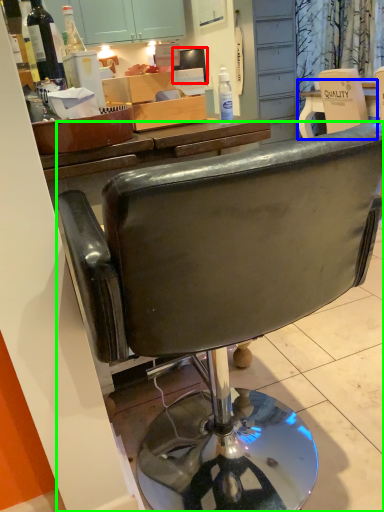
Question: Which object is the closest to the television (highlighted by a red box)? Choose among these: desk (highlighted by a blue box) or chair (highlighted by a green box).

Choices:
 (A) desk
 (B) chair

Answer: (B)